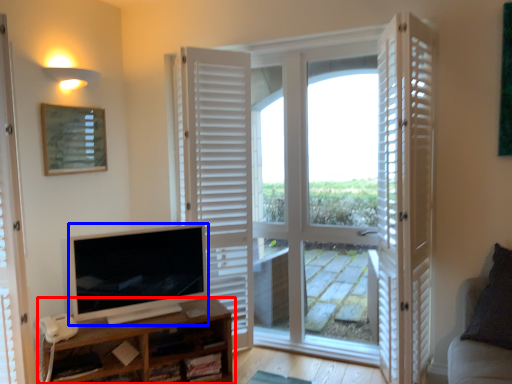
Question: Which object is further to the camera taking this photo, shelf (highlighted by a red box) or television (highlighted by a blue box)?

Choices:
 (A) shelf
 (B) television

Answer: (B)